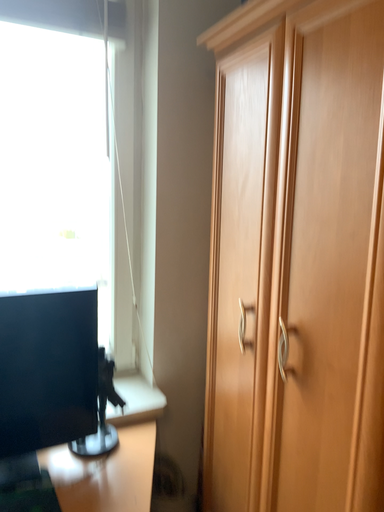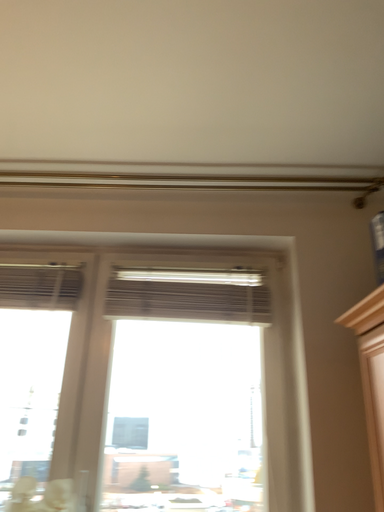
Question: How did the camera likely rotate when shooting the video?

Choices:
 (A) rotated upward
 (B) rotated downward

Answer: (A)